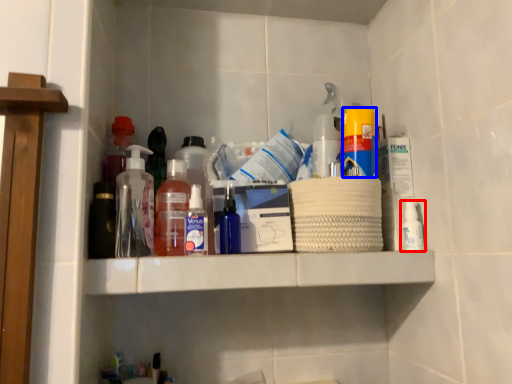
Question: Which object appears closest to the camera in this image, bottle (highlighted by a red box) or cleaning product (highlighted by a blue box)?

Choices:
 (A) bottle
 (B) cleaning product

Answer: (B)